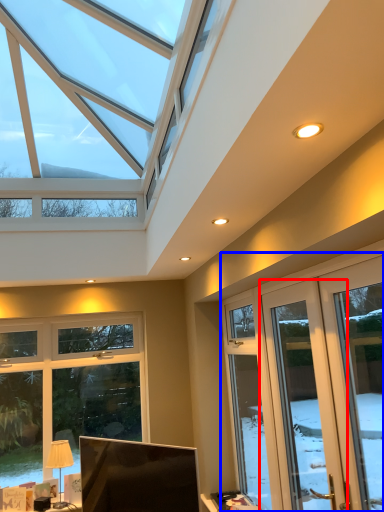
Question: Which point is closer to the camera, screen door (highlighted by a red box) or screen door (highlighted by a blue box)?

Choices:
 (A) screen door
 (B) screen door

Answer: (B)